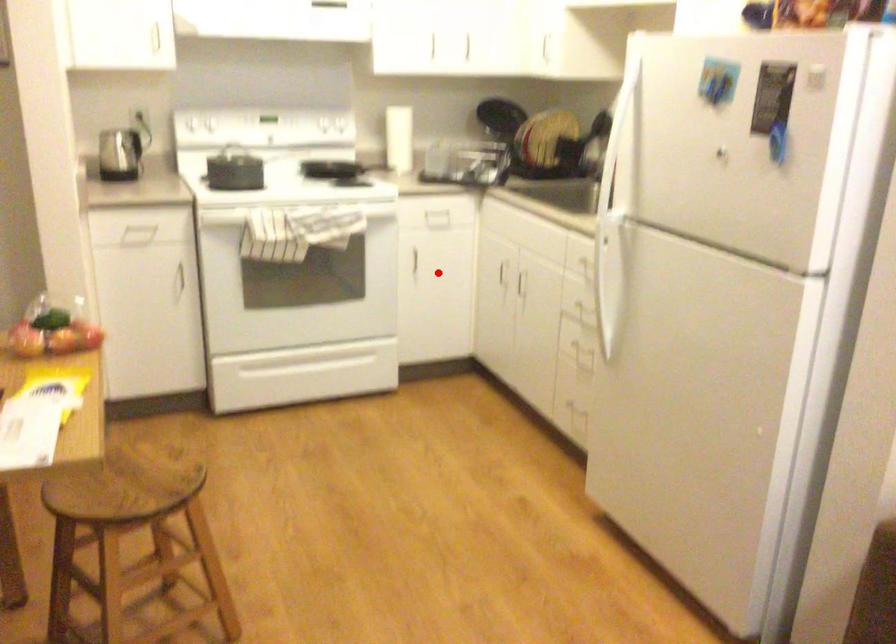
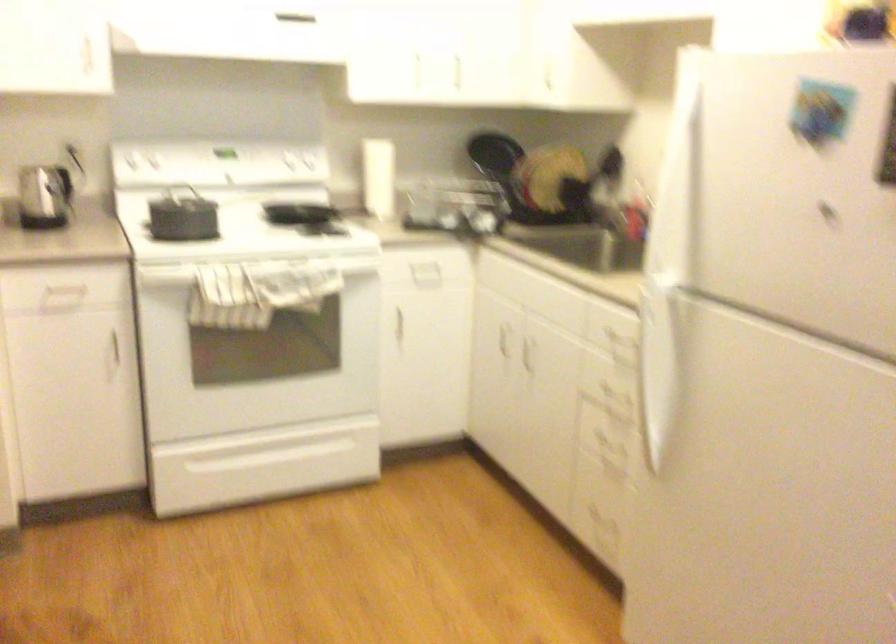
Question: I am providing you with two images of the same scene from different viewpoints. Given a red point in image1, look at the same physical point in image2. Is it:

Choices:
 (A) Closer to the viewpoint
 (B) Farther from the viewpoint

Answer: (A)